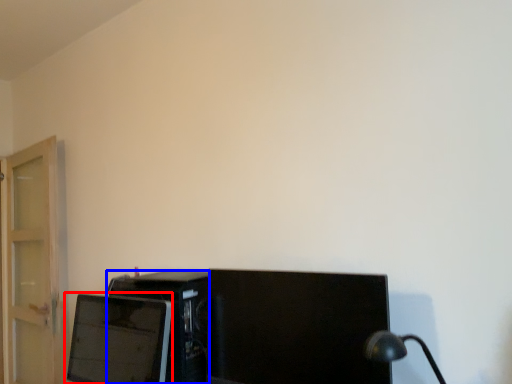
Question: Which point is closer to the camera, computer monitor (highlighted by a red box) or desktop computer (highlighted by a blue box)?

Choices:
 (A) computer monitor
 (B) desktop computer

Answer: (A)